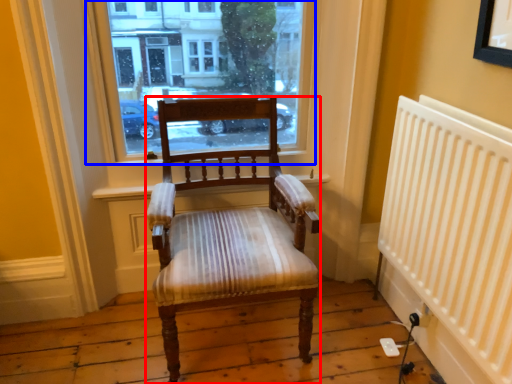
Question: Which point is further to the camera, chair (highlighted by a red box) or window (highlighted by a blue box)?

Choices:
 (A) chair
 (B) window

Answer: (B)